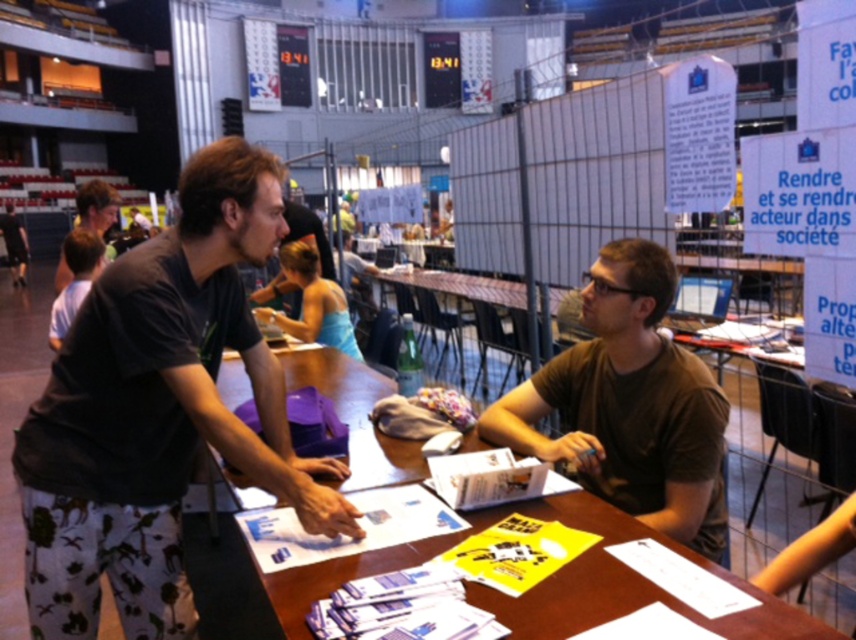
Which of these two, dark gray t-shirt at left or brown matte shirt at center, stands taller?

With more height is dark gray t-shirt at left.

Does point (119, 422) come farther from viewer compared to point (586, 362)?

That is False.

This screenshot has width=856, height=640. In order to click on dark gray t-shirt at left in this screenshot , I will do `click(159, 412)`.

Between brown matte shirt at center and dark brown shirt at upper left, which one appears on the right side from the viewer's perspective?

Positioned to the right is brown matte shirt at center.

Does brown matte shirt at center have a lesser height compared to dark brown shirt at upper left?

Yes.

The width and height of the screenshot is (856, 640). Describe the element at coordinates (629, 404) in the screenshot. I see `brown matte shirt at center` at that location.

Identify the location of brown matte shirt at center. (629, 404).

Does wooden table at center come in front of matte black shirt at center?

Yes, it is.

Can you confirm if wooden table at center is wider than matte black shirt at center?

Correct, the width of wooden table at center exceeds that of matte black shirt at center.

Which is behind, point (486, 593) or point (301, 220)?

Point (301, 220)

This screenshot has width=856, height=640. Identify the location of wooden table at center. coord(265,586).